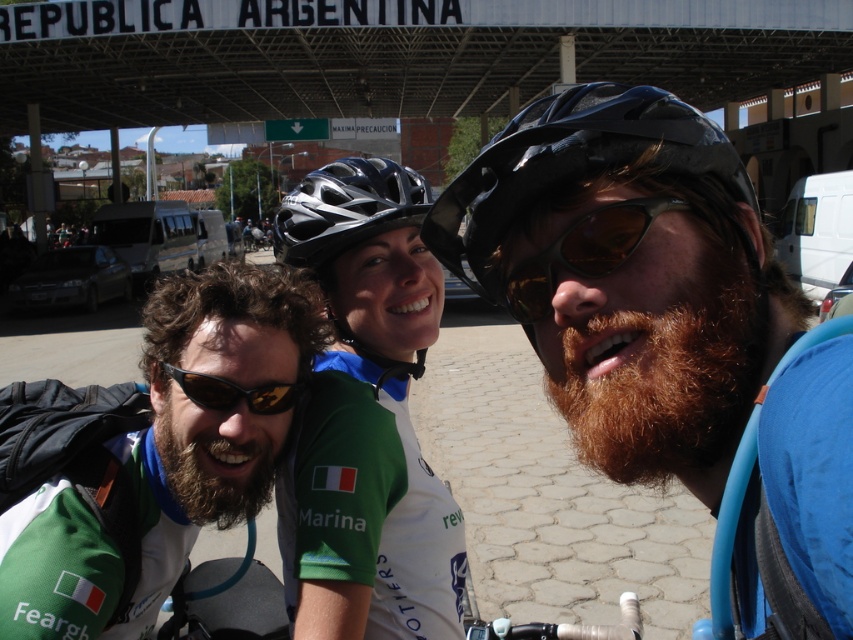
Between point (532, 109) and point (482, 244), which one is positioned behind?

Positioned behind is point (482, 244).

Who is more forward, (619, 90) or (630, 152)?

Point (630, 152) is more forward.

Identify the location of matte blue helmet at center. The height and width of the screenshot is (640, 853). (666, 328).

Which is more to the right, green fabric jersey at center or brownwoollybeard at center?

From the viewer's perspective, green fabric jersey at center appears more on the right side.

Is green fabric jersey at center thinner than brownwoollybeard at center?

Incorrect, green fabric jersey at center's width is not less than brownwoollybeard at center's.

Identify the location of green fabric jersey at center. The image size is (853, 640). (367, 412).

Can you confirm if black matte bicycle helmet at center is taller than brownwoollybeard at center?

No, black matte bicycle helmet at center is not taller than brownwoollybeard at center.

Between point (479, 163) and point (234, 465), which one is positioned behind?

Point (234, 465)

Where is `black matte bicycle helmet at center`? This screenshot has height=640, width=853. black matte bicycle helmet at center is located at coordinates (567, 164).